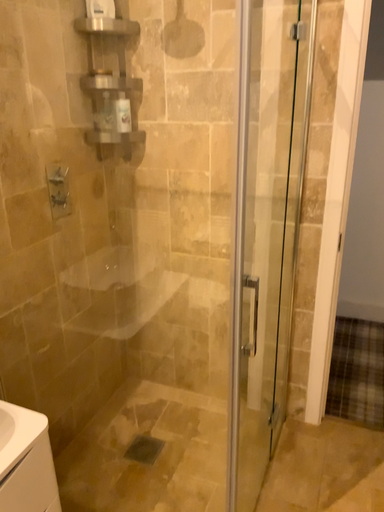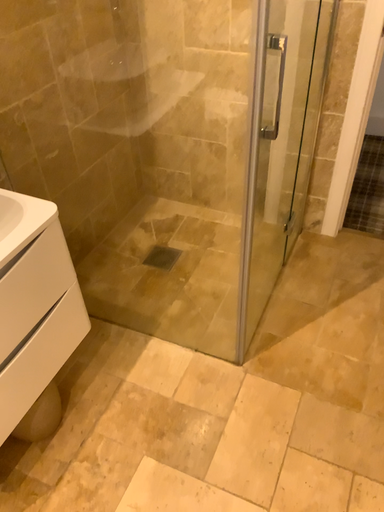
Question: How did the camera likely rotate when shooting the video?

Choices:
 (A) rotated upward
 (B) rotated downward

Answer: (B)